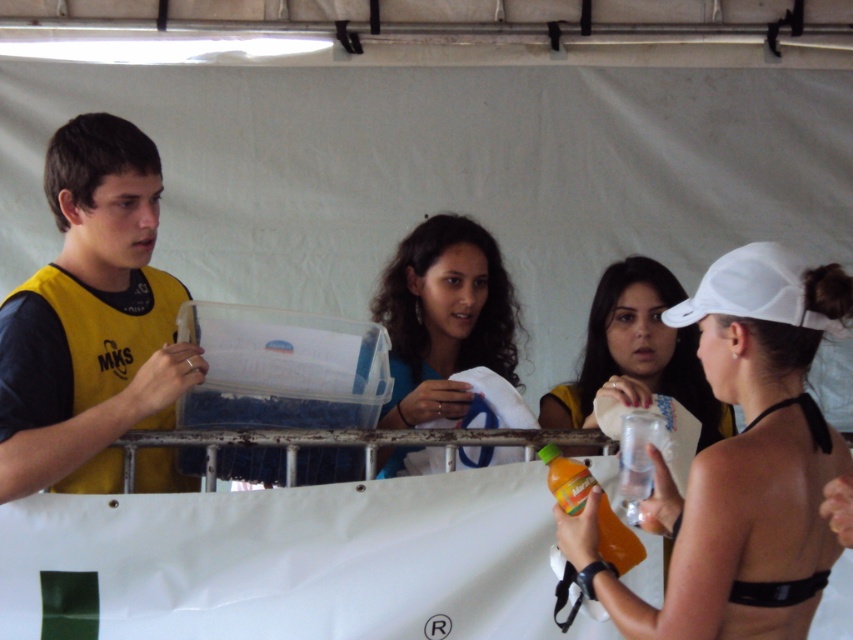
You are standing at the position of the person with the yellow vest. Which of the two points, point (22, 477) or point (759, 300), is closer to you?

Point (22, 477) is closer to you because it is further to the viewer than point (759, 300).

Based on the photo, based on the scene described, which object has a smaller width between the yellow fabric shirt at left and the matte white cap at center?

The yellow fabric shirt at left has a lesser width compared to the matte white cap at center, so the yellow fabric shirt at left is smaller in width.